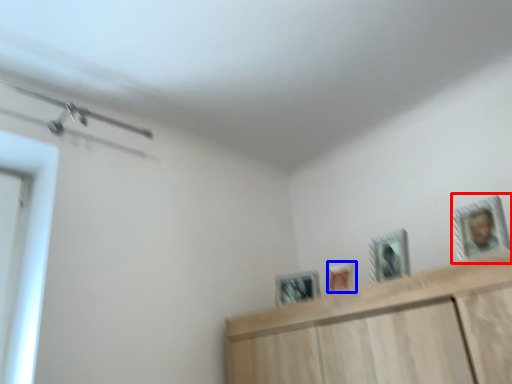
Question: Which object is further to the camera taking this photo, picture frame (highlighted by a red box) or picture frame (highlighted by a blue box)?

Choices:
 (A) picture frame
 (B) picture frame

Answer: (B)